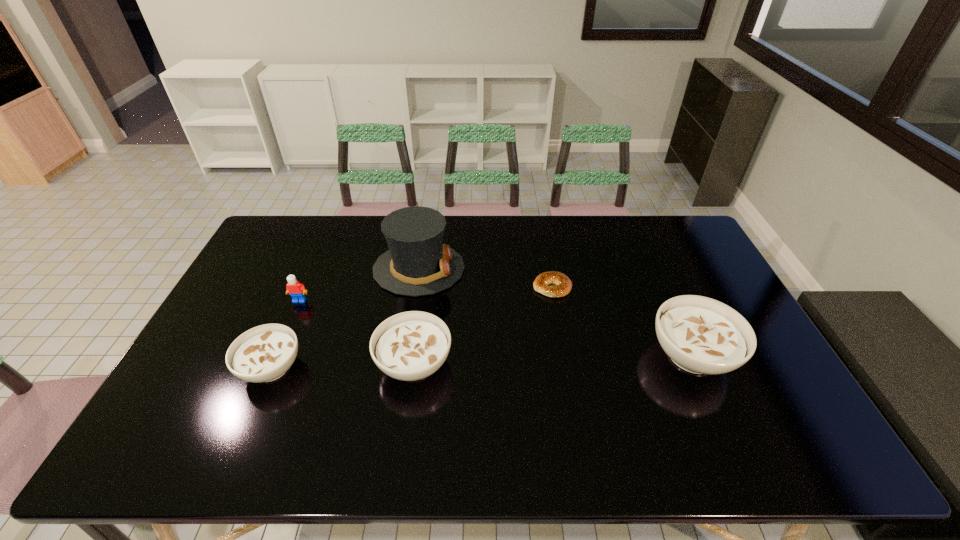
You are a GUI agent. You are given a task and a screenshot of the screen. Output one action in this format:
    pyautogui.click(x=<x>, y=<y>)
    Task: Click on the vacant spot for a new soup_bowl to ensure equal spacing
    
    Given the screenshot: What is the action you would take?
    pyautogui.click(x=554, y=359)